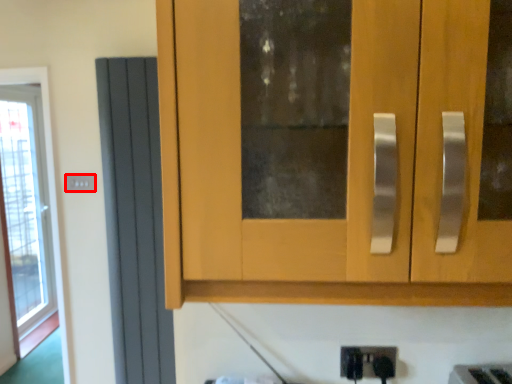
Question: From the image's perspective, considering the relative positions of electric outlet (annotated by the red box) and screen door in the image provided, where is electric outlet (annotated by the red box) located with respect to the staircase?

Choices:
 (A) above
 (B) below

Answer: (A)